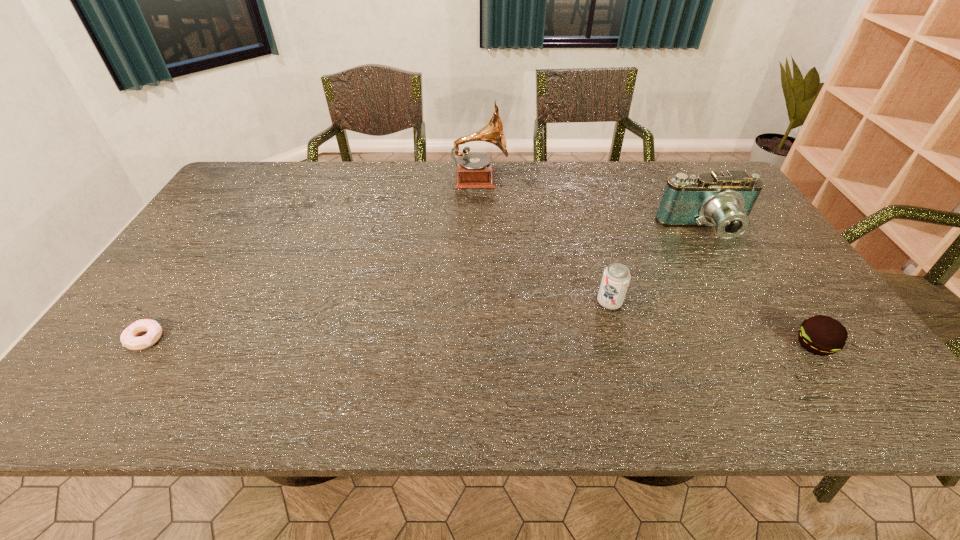
Image resolution: width=960 pixels, height=540 pixels. Find the location of `free space at the far left corner of the desktop`. free space at the far left corner of the desktop is located at coordinates (269, 172).

The image size is (960, 540). Find the location of `vacant position at the near left corner of the desktop`. vacant position at the near left corner of the desktop is located at coordinates (145, 406).

This screenshot has height=540, width=960. I want to click on vacant space at the near right corner of the desktop, so click(x=876, y=385).

The image size is (960, 540). What are the coordinates of `free spot between the leftmost object and the fourth nearest object` in the screenshot? It's located at (425, 285).

What are the coordinates of `free space between the camcorder and the doughnut` in the screenshot? It's located at (425, 285).

At what (x,y) coordinates should I click in order to perform the action: click on free space between the tallest object and the doughnut. Please return your answer as a coordinate pair (x, y). This screenshot has width=960, height=540. Looking at the image, I should click on (312, 259).

In order to click on unoccupied position between the second object from left to right and the fourth nearest object in this screenshot , I will do `click(592, 205)`.

The image size is (960, 540). I want to click on free space between the patty and the third farthest object, so pos(712,323).

Identify the location of unoccupied position between the second shortest object and the doughnut. The image size is (960, 540). (480, 342).

You are a GUI agent. You are given a task and a screenshot of the screen. Output one action in this format:
    pyautogui.click(x=<x>, y=<y>)
    Task: Click on the free area in between the third object from left to right and the doughnut
    The height and width of the screenshot is (540, 960).
    Given the screenshot: What is the action you would take?
    pyautogui.click(x=377, y=321)